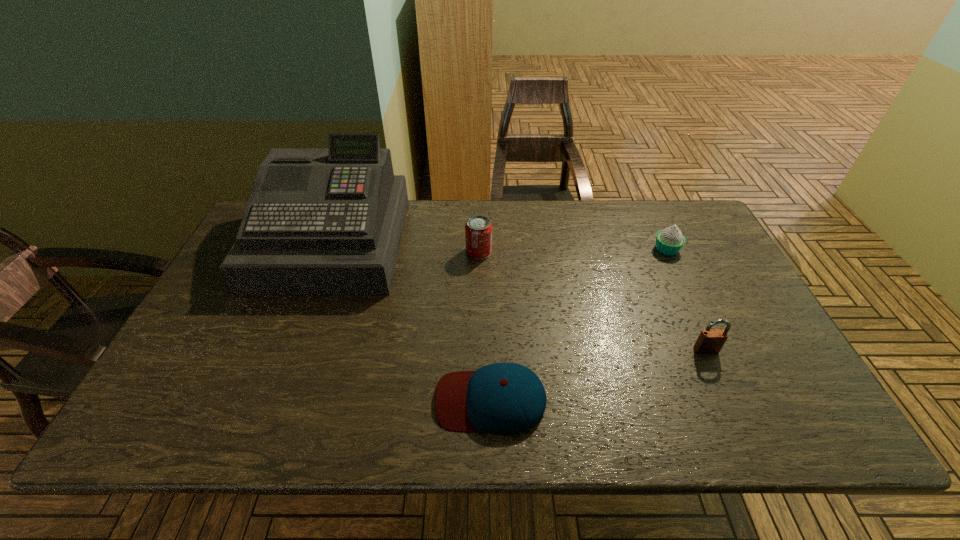
Locate an element on the screen. This screenshot has height=540, width=960. cash register is located at coordinates (329, 221).

You are a GUI agent. You are given a task and a screenshot of the screen. Output one action in this format:
    pyautogui.click(x=<x>, y=<y>)
    Task: Click on the leftmost object
    Image resolution: width=960 pixels, height=540 pixels.
    Given the screenshot: What is the action you would take?
    (329, 221)

Identify the location of can. The image size is (960, 540). (478, 229).

Where is `the fourth farthest object`? the fourth farthest object is located at coordinates (710, 341).

At what (x,y) coordinates should I click in order to perform the action: click on the second shortest object. Please return your answer as a coordinate pair (x, y). The height and width of the screenshot is (540, 960). Looking at the image, I should click on (669, 241).

Locate an element on the screen. The height and width of the screenshot is (540, 960). the shortest object is located at coordinates (502, 398).

Identify the location of baseball cap. (502, 398).

Where is `vacant space positioned 0.270m on the front-facing side of the cash register`? This screenshot has width=960, height=540. vacant space positioned 0.270m on the front-facing side of the cash register is located at coordinates (279, 380).

Locate an element on the screen. The image size is (960, 540). vacant space located 0.280m on the right of the can is located at coordinates (584, 252).

Identify the location of vacant area situated on the front-facing side of the second nearest object. (724, 390).